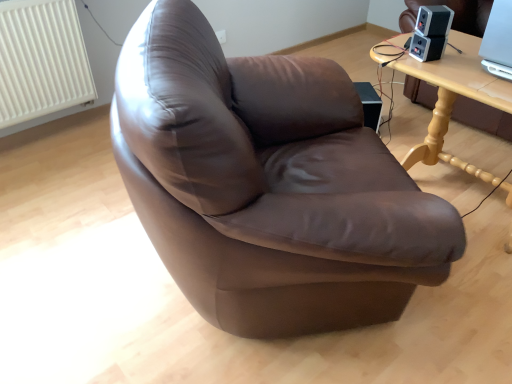
Question: Based on their positions, is satin black speaker at upper right, the 1th speaker when ordered from bottom to top, located to the left or right of white textured radiator at upper left?

Choices:
 (A) right
 (B) left

Answer: (A)

Question: From a real-world perspective, relative to white textured radiator at upper left, is satin black speaker at upper right, the 2th speaker when ordered from top to bottom, vertically above or below?

Choices:
 (A) above
 (B) below

Answer: (A)

Question: Considering the real-world distances, which object is farthest from the black plastic speaker at upper right, which ranks as the second speaker in bottom-to-top order?

Choices:
 (A) light wood table at upper right
 (B) satin black speaker at upper right, the 2th speaker when ordered from top to bottom
 (C) white textured radiator at upper left

Answer: (C)

Question: Based on their relative distances, which object is farther from the black plastic speaker at upper right, which ranks as the second speaker in bottom-to-top order?

Choices:
 (A) satin black speaker at upper right, the 2th speaker when ordered from top to bottom
 (B) white textured radiator at upper left
 (C) light wood table at upper right

Answer: (B)